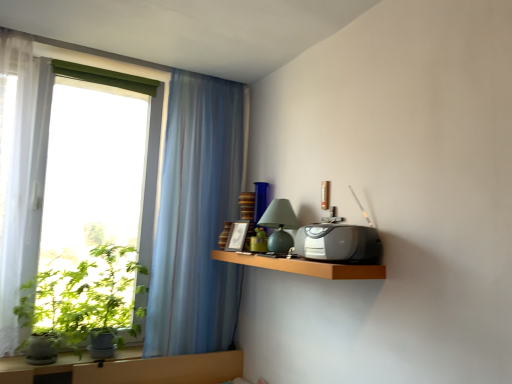
Question: From a real-world perspective, is wooden shelf at upper right physically located above or below satin black radio at upper right?

Choices:
 (A) below
 (B) above

Answer: (A)

Question: From the image's perspective, relative to satin black radio at upper right, is wooden shelf at upper right above or below?

Choices:
 (A) below
 (B) above

Answer: (A)

Question: Which object is positioned closest to the transparent glass window at left?

Choices:
 (A) satin black radio at upper right
 (B) translucent blue curtain at upper left
 (C) wooden shelf at upper right
 (D) green leafy plant at left
 (E) matte green glass table lamp at center

Answer: (B)

Question: Based on their relative distances, which object is nearer to the matte green glass table lamp at center?

Choices:
 (A) wooden shelf at upper right
 (B) satin black radio at upper right
 (C) green leafy plant at left
 (D) translucent blue curtain at upper left
 (E) transparent glass window at left

Answer: (A)